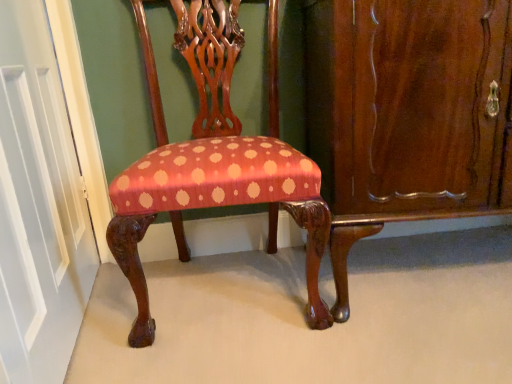
Identify the location of vacant region below silky red fabric chair at center (from a real-world perspective). This screenshot has height=384, width=512. (226, 292).